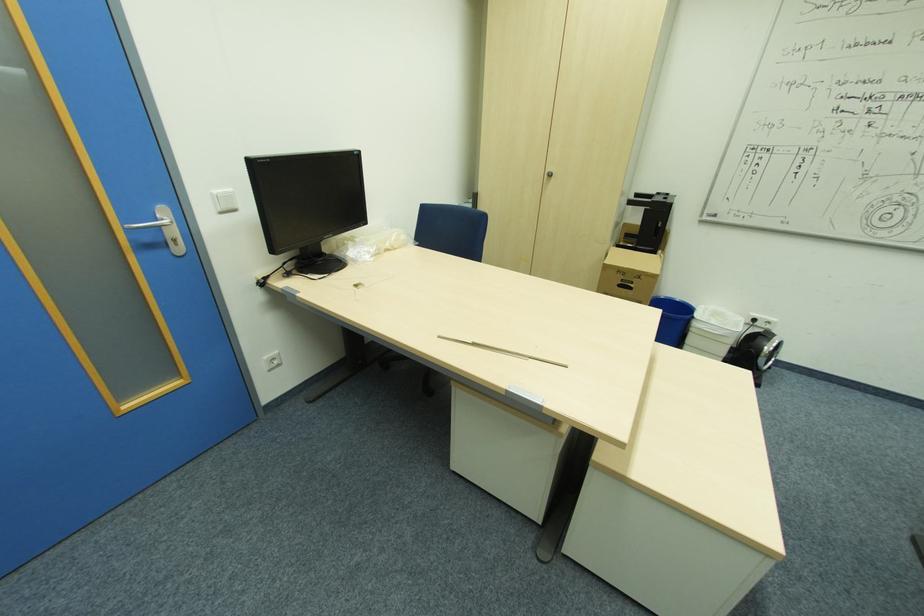
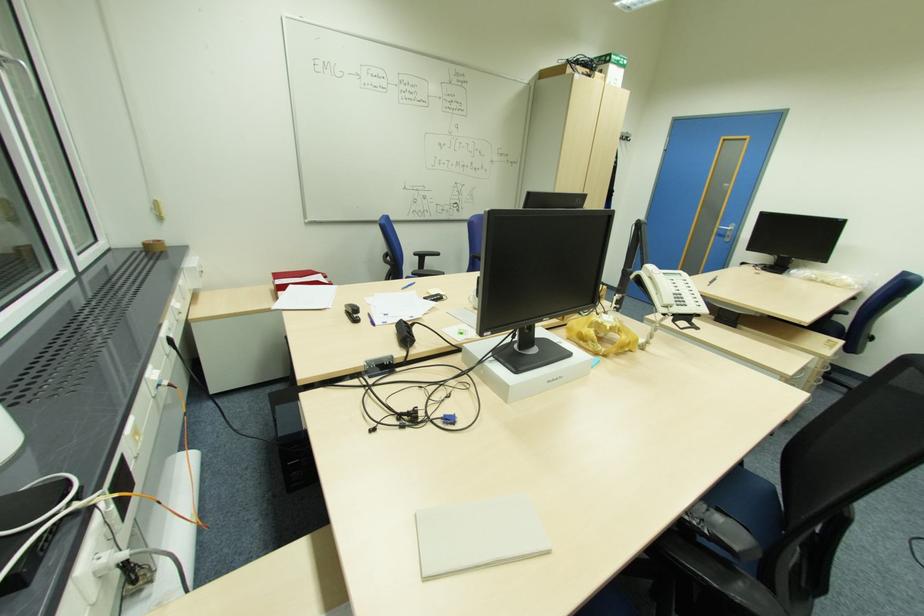
In the second image, find the point that corresponds to point 176,240 in the first image.

(732, 236)